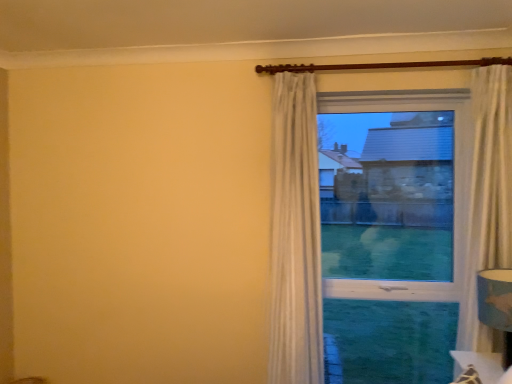
Question: Is transparent glass window at center at the left side of white textured curtain at upper center?

Choices:
 (A) yes
 (B) no

Answer: (B)

Question: Is transparent glass window at center located outside white textured curtain at upper center?

Choices:
 (A) no
 (B) yes

Answer: (B)

Question: Does transparent glass window at center have a greater height compared to white textured curtain at upper center?

Choices:
 (A) yes
 (B) no

Answer: (B)

Question: Is transparent glass window at center oriented towards white textured curtain at upper center?

Choices:
 (A) no
 (B) yes

Answer: (A)

Question: Considering the relative sizes of transparent glass window at center and white textured curtain at upper center in the image provided, is transparent glass window at center bigger than white textured curtain at upper center?

Choices:
 (A) no
 (B) yes

Answer: (A)

Question: From a real-world perspective, is transparent glass window at center on white textured curtain at upper center?

Choices:
 (A) yes
 (B) no

Answer: (A)

Question: Is transparent glass window at center bigger than blue fabric lampshade at lower right?

Choices:
 (A) no
 (B) yes

Answer: (B)

Question: From a real-world perspective, is transparent glass window at center on top of blue fabric lampshade at lower right?

Choices:
 (A) yes
 (B) no

Answer: (A)

Question: Can you confirm if transparent glass window at center is shorter than blue fabric lampshade at lower right?

Choices:
 (A) yes
 (B) no

Answer: (B)

Question: Is there a large distance between transparent glass window at center and blue fabric lampshade at lower right?

Choices:
 (A) yes
 (B) no

Answer: (B)

Question: Is blue fabric lampshade at lower right surrounded by transparent glass window at center?

Choices:
 (A) yes
 (B) no

Answer: (B)

Question: Considering the relative sizes of transparent glass window at center and blue fabric lampshade at lower right in the image provided, is transparent glass window at center wider than blue fabric lampshade at lower right?

Choices:
 (A) yes
 (B) no

Answer: (B)

Question: Is blue fabric lampshade at lower right surrounded by white textured curtain at upper center?

Choices:
 (A) yes
 (B) no

Answer: (B)